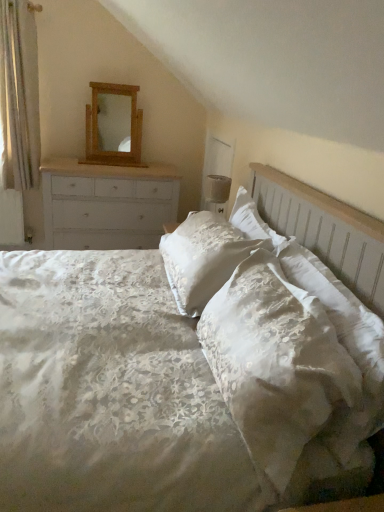
Locate an element on the screen. This screenshot has height=512, width=384. linen bed at center is located at coordinates (109, 392).

Measure the distance between point (65,214) and camera.

The depth of point (65,214) is 3.38 meters.

What do you see at coordinates (19, 96) in the screenshot? I see `white sheer curtain at left` at bounding box center [19, 96].

At what (x,y) coordinates should I click in order to perform the action: click on linen bed at center. Please return your answer as a coordinate pair (x, y). Looking at the image, I should click on (109, 392).

Considering the sizes of objects white painted wood chest of drawers at left and linen bed at center in the image provided, who is shorter, white painted wood chest of drawers at left or linen bed at center?

Standing shorter between the two is white painted wood chest of drawers at left.

Is white painted wood chest of drawers at left next to linen bed at center and touching it?

There is a gap between white painted wood chest of drawers at left and linen bed at center.

Looking at this image, is white painted wood chest of drawers at left at the right side of linen bed at center?

No, white painted wood chest of drawers at left is not to the right of linen bed at center.

Considering the relative sizes of white painted wood chest of drawers at left and linen bed at center in the image provided, is white painted wood chest of drawers at left wider than linen bed at center?

No.

Can we say wooden mirror at upper center lies outside white sheer curtain at left?

Absolutely, wooden mirror at upper center is external to white sheer curtain at left.

Based on the photo, could you tell me if wooden mirror at upper center is facing white sheer curtain at left?

No, wooden mirror at upper center is not aimed at white sheer curtain at left.

Are wooden mirror at upper center and white sheer curtain at left making contact?

No, wooden mirror at upper center is not next to white sheer curtain at left.

Is point (107, 85) farther from viewer compared to point (30, 165)?

No, (107, 85) is in front of (30, 165).

Is linen bed at center oriented away from wooden mirror at upper center?

linen bed at center is not turned away from wooden mirror at upper center.

Does point (54, 273) appear closer or farther from the camera than point (94, 155)?

Clearly, point (54, 273) is closer to the camera than point (94, 155).

Is linen bed at center bigger than wooden mirror at upper center?

Correct, linen bed at center is larger in size than wooden mirror at upper center.

From the image's perspective, is linen bed at center below wooden mirror at upper center?

Indeed, from the image's perspective, linen bed at center is shown beneath wooden mirror at upper center.

You are a GUI agent. You are given a task and a screenshot of the screen. Output one action in this format:
    pyautogui.click(x=<x>, y=<y>)
    Task: Click on the mirror behind the white satin pillow at center
    The width and height of the screenshot is (384, 512).
    Given the screenshot: What is the action you would take?
    pyautogui.click(x=113, y=126)

Looking at this image, which object is further away from the camera, wooden mirror at upper center or white satin pillow at center?

wooden mirror at upper center is further away from the camera.

Is wooden mirror at upper center not close to white satin pillow at center?

Yes, wooden mirror at upper center and white satin pillow at center are located far from each other.

Is matte white lampshade at upper right aimed at wooden mirror at upper center?

No.

Does matte white lampshade at upper right appear on the right side of wooden mirror at upper center?

Correct, you'll find matte white lampshade at upper right to the right of wooden mirror at upper center.

Which of these two, linen bed at center or white painted wood chest of drawers at left, is smaller?

white painted wood chest of drawers at left is smaller.

Which of these two, linen bed at center or white painted wood chest of drawers at left, stands taller?

linen bed at center.

Does linen bed at center turn towards white painted wood chest of drawers at left?

No.

Is linen bed at center wider than white painted wood chest of drawers at left?

Indeed, linen bed at center has a greater width compared to white painted wood chest of drawers at left.

At what (x,y) coordinates should I click in order to perform the action: click on the chest of drawers that appears above the white satin pillow at center (from the image's perspective). Please return your answer as a coordinate pair (x, y). Looking at the image, I should click on (107, 205).

Is white painted wood chest of drawers at left at the back of white satin pillow at center?

That's not correct — white satin pillow at center is not looking away from white painted wood chest of drawers at left.

Can we say white satin pillow at center lies outside white painted wood chest of drawers at left?

Indeed, white satin pillow at center is completely outside white painted wood chest of drawers at left.

Identify the location of bed above the white painted wood chest of drawers at left (from a real-world perspective). This screenshot has height=512, width=384. click(109, 392).

At what (x,y) coordinates should I click in order to perform the action: click on curtain on the left of wooden mirror at upper center. Please return your answer as a coordinate pair (x, y). The width and height of the screenshot is (384, 512). Looking at the image, I should click on (19, 96).

Considering their positions, is white satin pillow at center positioned further to white sheer curtain at left than matte white lampshade at upper right?

white satin pillow at center is further to white sheer curtain at left.

From the picture: Which object lies further to the anchor point white satin pillow at center, matte white lampshade at upper right or wooden mirror at upper center?

The object further to white satin pillow at center is wooden mirror at upper center.

Estimate the real-world distances between objects in this image. Which object is closer to matte white lampshade at upper right, wooden mirror at upper center or white painted wood chest of drawers at left?

white painted wood chest of drawers at left is positioned closer to the anchor matte white lampshade at upper right.

Which object lies nearer to the anchor point matte white lampshade at upper right, white painted wood chest of drawers at left or linen bed at center?

Based on the image, white painted wood chest of drawers at left appears to be nearer to matte white lampshade at upper right.

Which object lies nearer to the anchor point linen bed at center, matte white lampshade at upper right or wooden mirror at upper center?

matte white lampshade at upper right.

From the image, which object appears to be farther from white sheer curtain at left, linen bed at center or white satin pillow at center?

white satin pillow at center.

Estimate the real-world distances between objects in this image. Which object is further from matte white lampshade at upper right, white sheer curtain at left or white satin pillow at center?

Based on the image, white sheer curtain at left appears to be further to matte white lampshade at upper right.

Based on their spatial positions, is white sheer curtain at left or wooden mirror at upper center closer to white painted wood chest of drawers at left?

Based on the image, wooden mirror at upper center appears to be nearer to white painted wood chest of drawers at left.

Where is `lamp between linen bed at center and white painted wood chest of drawers at left from front to back`? This screenshot has width=384, height=512. lamp between linen bed at center and white painted wood chest of drawers at left from front to back is located at coordinates (217, 192).

You are a GUI agent. You are given a task and a screenshot of the screen. Output one action in this format:
    pyautogui.click(x=<x>, y=<y>)
    Task: Click on the chest of drawers located between linen bed at center and wooden mirror at upper center in the depth direction
    This screenshot has width=384, height=512.
    Given the screenshot: What is the action you would take?
    pyautogui.click(x=107, y=205)

Identify the location of curtain between linen bed at center and wooden mirror at upper center in the front-back direction. pos(19,96).

The image size is (384, 512). Find the location of `lamp positioned between white satin pillow at center and wooden mirror at upper center from near to far`. lamp positioned between white satin pillow at center and wooden mirror at upper center from near to far is located at coordinates [217, 192].